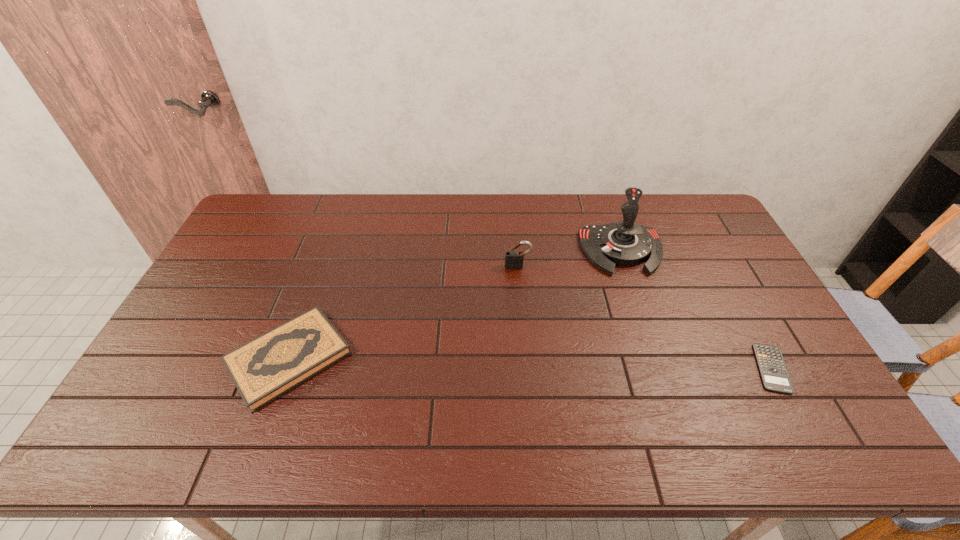
Find the location of a particular element. vacant point located on the right of the hardback book is located at coordinates (481, 358).

Identify the location of free point located on the back of the rightmost object. The image size is (960, 540). (712, 261).

You are a GUI agent. You are given a task and a screenshot of the screen. Output one action in this format:
    pyautogui.click(x=<x>, y=<y>)
    Task: Click on the object that is at the far edge
    
    Given the screenshot: What is the action you would take?
    tap(625, 243)

Image resolution: width=960 pixels, height=540 pixels. I want to click on object that is positioned at the right edge, so click(x=774, y=374).

This screenshot has width=960, height=540. In the image, there is a desktop. In order to click on vacant space at the far edge in this screenshot , I will do `click(586, 200)`.

The height and width of the screenshot is (540, 960). In the image, there is a desktop. Identify the location of free region at the near edge. coord(277,444).

Find the location of a particular element. The image size is (960, 540). vacant space at the left edge of the desktop is located at coordinates (204, 299).

Find the location of a particular element. The width and height of the screenshot is (960, 540). vacant region at the near left corner of the desktop is located at coordinates (146, 431).

In order to click on vacant position at the far right corner of the desktop in this screenshot , I will do `click(714, 220)`.

Locate an element on the screen. Image resolution: width=960 pixels, height=540 pixels. free space between the second object from left to right and the leftmost object is located at coordinates (403, 312).